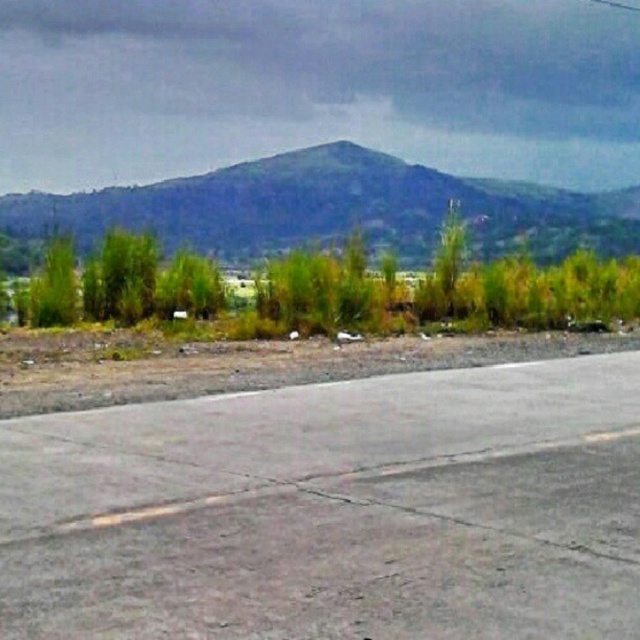
Question: Can you confirm if gray asphalt tarmac at lower center is positioned to the right of green grassy hill at upper center?

Choices:
 (A) yes
 (B) no

Answer: (B)

Question: Which point is closer to the camera taking this photo?

Choices:
 (A) pos(212,211)
 (B) pos(257,570)

Answer: (B)

Question: Is gray asphalt tarmac at lower center to the left of green grassy hill at upper center from the viewer's perspective?

Choices:
 (A) yes
 (B) no

Answer: (A)

Question: Which point is closer to the camera?

Choices:
 (A) green grassy hill at upper center
 (B) gray asphalt tarmac at lower center

Answer: (B)

Question: Is gray asphalt tarmac at lower center above green grassy hill at upper center?

Choices:
 (A) no
 (B) yes

Answer: (A)

Question: Which point is closer to the camera?

Choices:
 (A) green grassy hill at upper center
 (B) gray asphalt tarmac at lower center

Answer: (B)